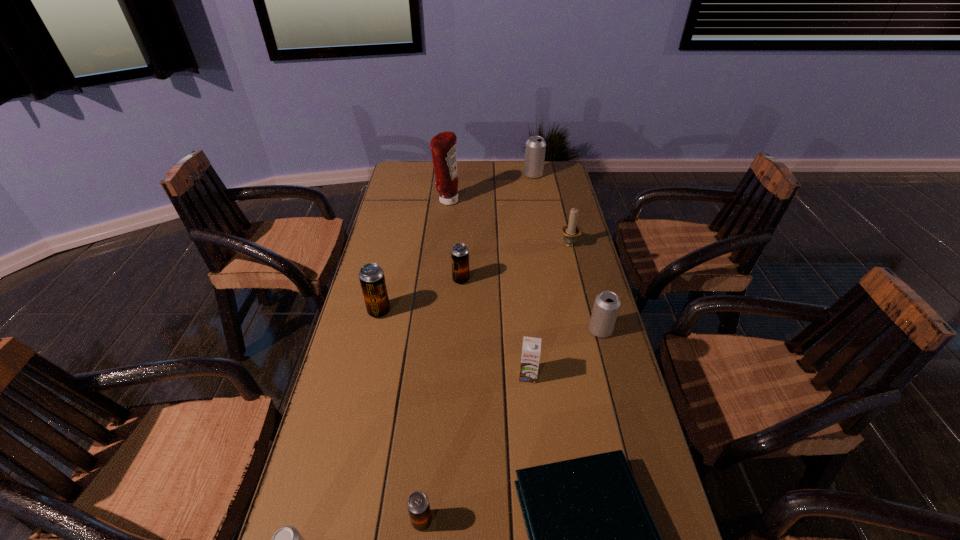
Where is `free space at the left edge of the desktop`? The image size is (960, 540). free space at the left edge of the desktop is located at coordinates (391, 196).

This screenshot has height=540, width=960. I want to click on vacant space at the right edge of the desktop, so click(x=612, y=418).

Find the location of `free space at the far right corner of the desktop`. free space at the far right corner of the desktop is located at coordinates (555, 180).

At what (x,y) coordinates should I click in order to perform the action: click on free area in between the farthest black beer can and the farthest object. Please return your answer as a coordinate pair (x, y). Looking at the image, I should click on (497, 227).

The width and height of the screenshot is (960, 540). Find the location of `empty space between the red condiment and the second smallest black beer can`. empty space between the red condiment and the second smallest black beer can is located at coordinates (454, 240).

Where is `free spot between the chocolate milk and the biggest white beer can`? This screenshot has width=960, height=540. free spot between the chocolate milk and the biggest white beer can is located at coordinates (531, 275).

This screenshot has width=960, height=540. In order to click on vacant space that's between the farthest beer can and the tallest object in this screenshot , I will do `click(490, 188)`.

The width and height of the screenshot is (960, 540). Identify the location of empty space that is in between the fourth nearest object and the second nearest black beer can. (454, 343).

The width and height of the screenshot is (960, 540). In order to click on vacant space that is in between the fifth beer can from left to right and the rightmost white beer can in this screenshot , I will do `click(566, 253)`.

Find the location of a particular element. Image resolution: width=960 pixels, height=540 pixels. vacant space that is in between the second smallest black beer can and the smallest black beer can is located at coordinates (442, 401).